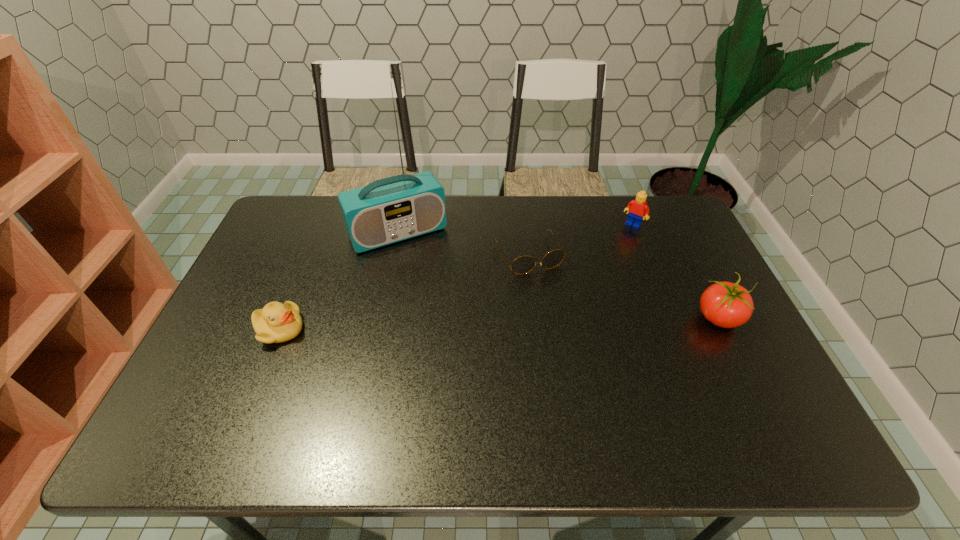
Where is `vacant area that lies between the rightmost object and the fourth object from left to right`? Image resolution: width=960 pixels, height=540 pixels. vacant area that lies between the rightmost object and the fourth object from left to right is located at coordinates (676, 272).

Select which object appears as the second closest to the duckling. Please provide its 2D coordinates. Your answer should be formatted as a tuple, i.e. [(x, y)], where the tuple contains the x and y coordinates of a point satisfying the conditions above.

[(524, 264)]

Locate an element on the screen. The width and height of the screenshot is (960, 540). object that is the third closest to the third object from right to left is located at coordinates (724, 304).

This screenshot has width=960, height=540. Identify the location of free point that satisfies the following two spatial constraints: 1. on the back side of the tallest object; 2. on the left side of the Lego. (399, 225).